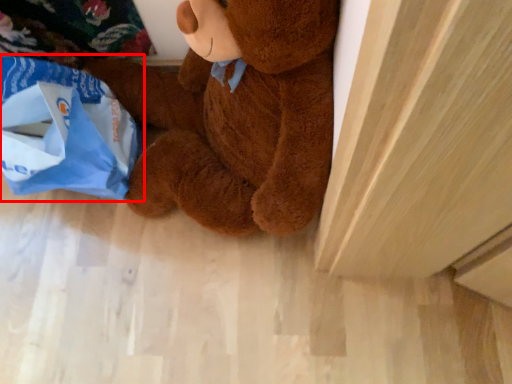
Question: Considering the relative positions of grocery bag (annotated by the red box) and teddy bear in the image provided, where is grocery bag (annotated by the red box) located with respect to the staircase?

Choices:
 (A) right
 (B) left

Answer: (B)